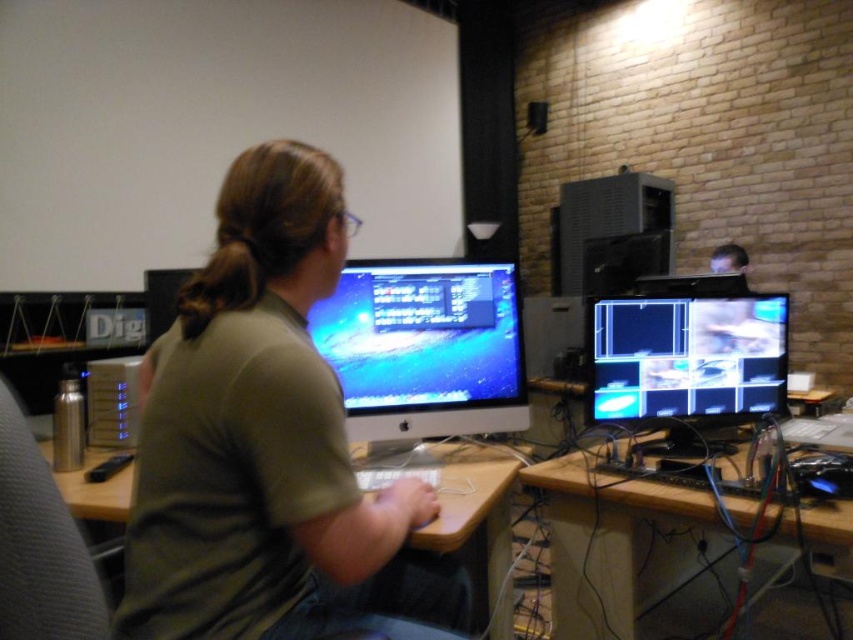
You are an interior designer looking to add a pop of color to the workspace. The green matte shirt at center is located at coordinates point 0.695, 0.317. Where would you place a new red accent pillow to complement it without overlapping?

Place the red accent pillow to the right of the green matte shirt at center since it is located at point (270, 444), leaving space to the right for the pillow without overlapping.

You are organizing the desk and notice the black glossy monitor at right and the wooden desk at center. Which object is placed on top of the other?

The black glossy monitor at right is positioned over the wooden desk at center, so the monitor is on top of the desk.

You are organizing a desk and need to place a new item between the wooden at center and brown hair at upper center. Which object should you place closer to the edge of the desk to ensure stability?

The wooden at center should be placed closer to the edge of the desk for stability since it is wider than the brown hair at upper center.